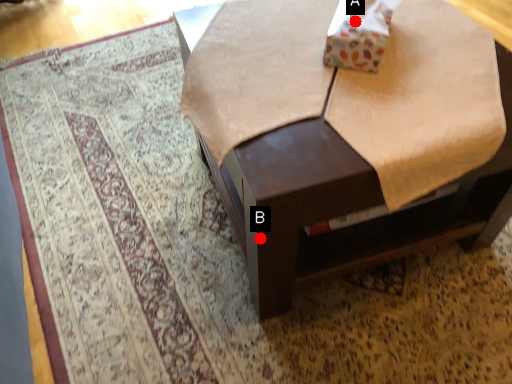
Question: Two points are circled on the image, labeled by A and B beside each circle. Which point appears farthest from the camera in this image?

Choices:
 (A) A is further
 (B) B is further

Answer: (A)